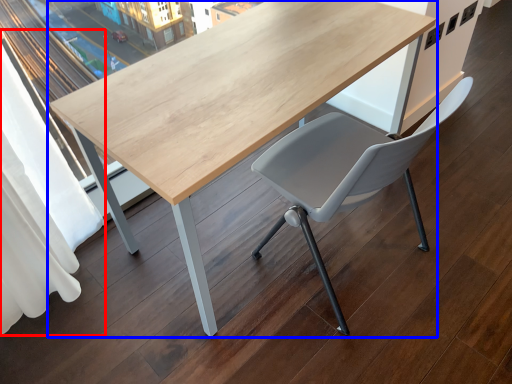
Question: Which point is closer to the camera, curtain (highlighted by a red box) or table (highlighted by a blue box)?

Choices:
 (A) curtain
 (B) table

Answer: (A)